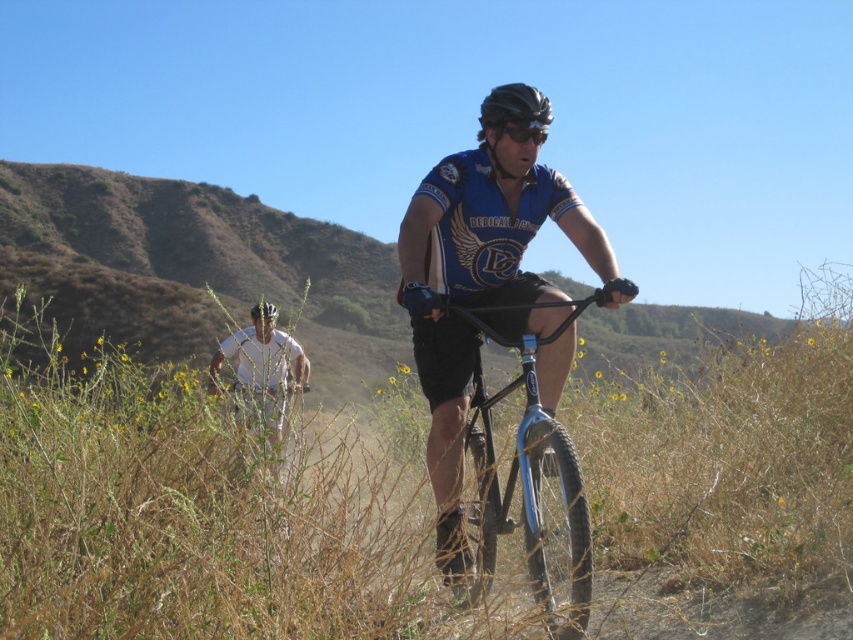
Question: Does white matte shirt at center lie behind black matte helmet at center?

Choices:
 (A) no
 (B) yes

Answer: (B)

Question: Can you confirm if shiny blue frame at center is positioned to the left of white matte bicycle helmet at center?

Choices:
 (A) no
 (B) yes

Answer: (A)

Question: Which object is positioned farthest from the shiny blue frame at center?

Choices:
 (A) white matte shirt at center
 (B) white matte bicycle helmet at center
 (C) black matte helmet at center

Answer: (A)

Question: Does white matte shirt at center have a larger size compared to white matte bicycle helmet at center?

Choices:
 (A) yes
 (B) no

Answer: (A)

Question: Which of these objects is positioned closest to the black matte helmet at center?

Choices:
 (A) white matte shirt at center
 (B) white matte bicycle helmet at center
 (C) shiny blue frame at center

Answer: (C)

Question: Which object appears farthest from the camera in this image?

Choices:
 (A) black matte helmet at center
 (B) white matte bicycle helmet at center
 (C) white matte shirt at center

Answer: (B)